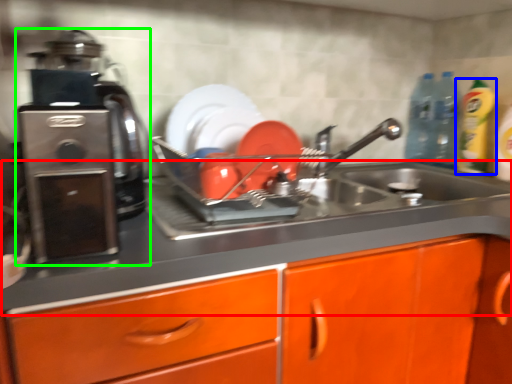
Question: Which object is positioned farthest from counter top (highlighted by a red box)? Select from cleaning product (highlighted by a blue box) and home appliance (highlighted by a green box).

Choices:
 (A) cleaning product
 (B) home appliance

Answer: (A)